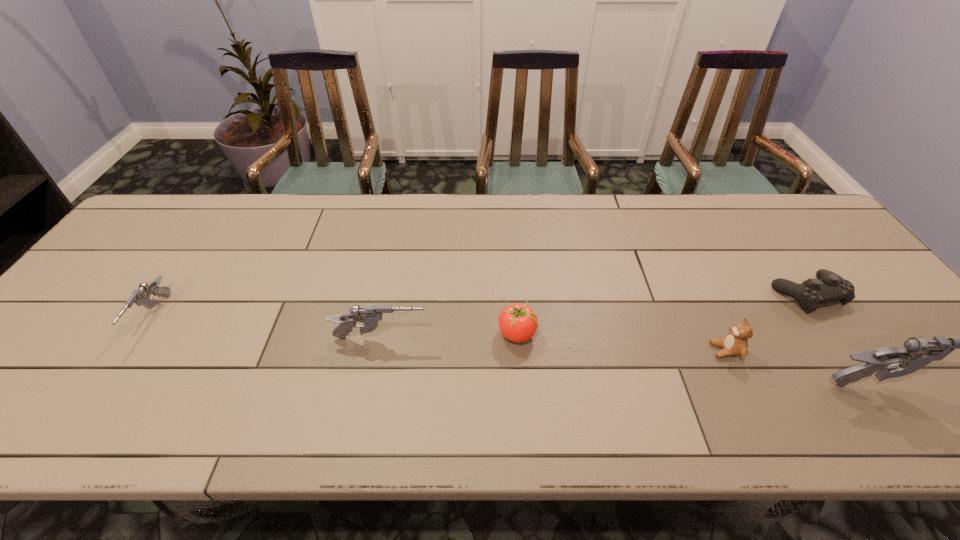
To achieve even spacing by inserting another gun among them, please point to a vacant spot for this new gun. Please provide its 2D coordinates. Your answer should be formatted as a tuple, i.e. [(x, y)], where the tuple contains the x and y coordinates of a point satisfying the conditions above.

[(628, 360)]